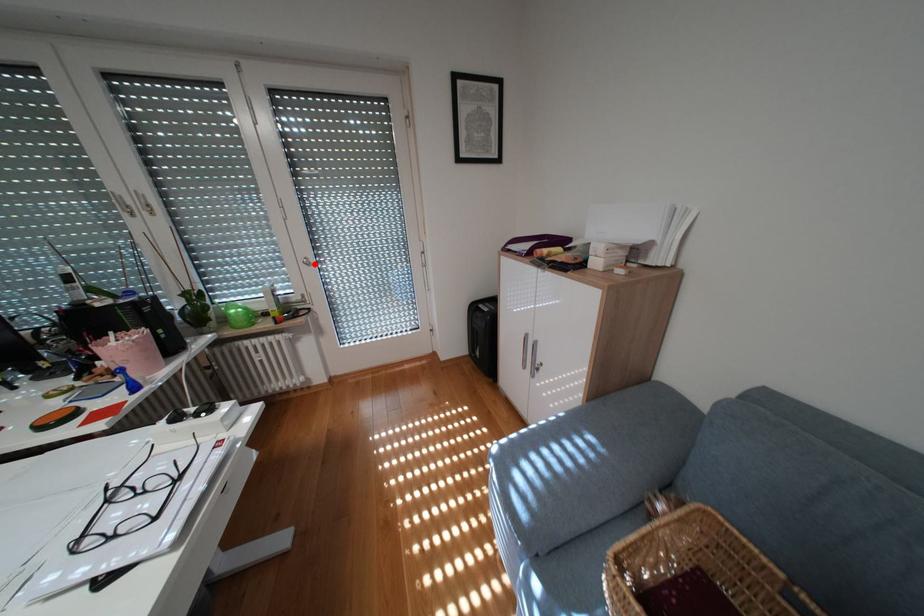
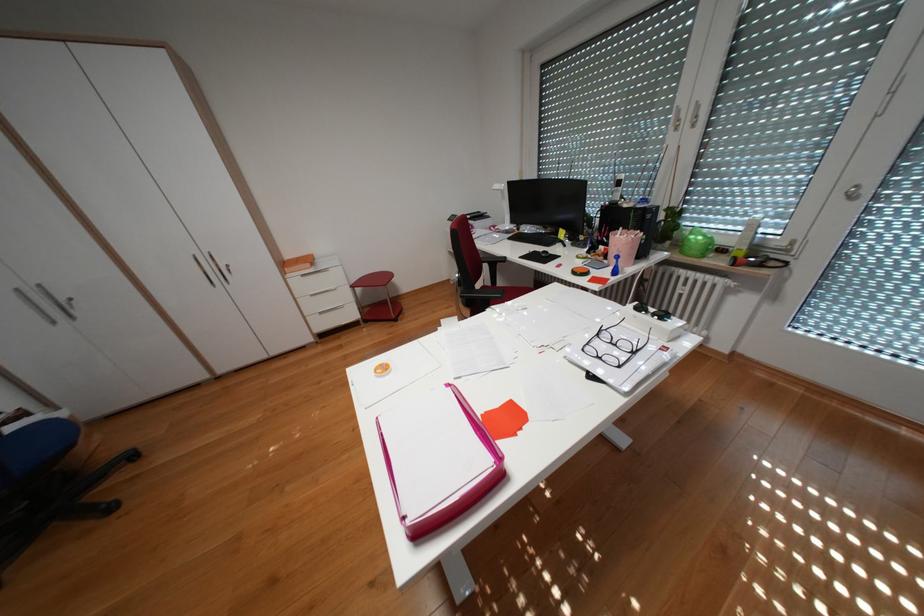
Question: I am providing you with two images of the same scene from different viewpoints. Given a red point in image1, look at the same physical point in image2. Is it:

Choices:
 (A) Closer to the viewpoint
 (B) Farther from the viewpoint

Answer: (B)